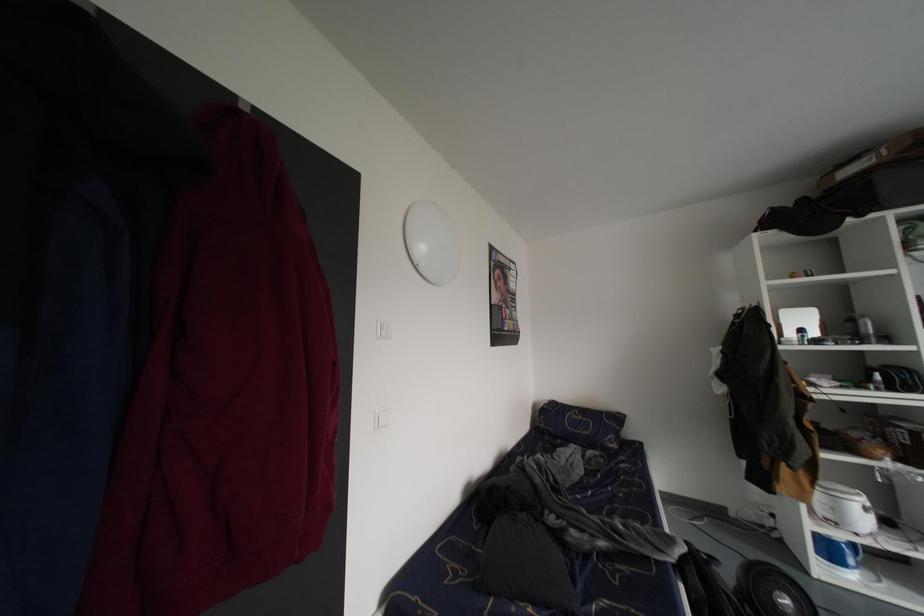
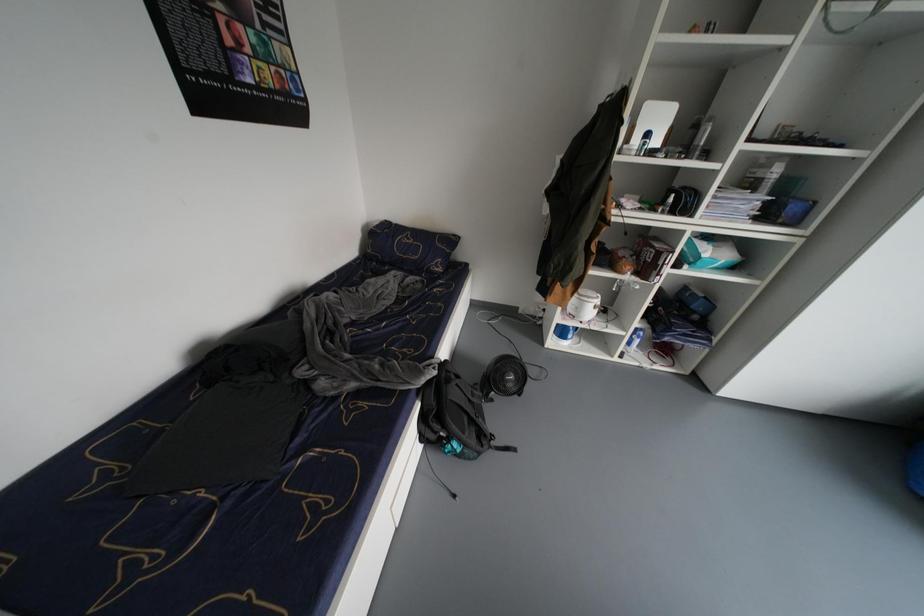
First-person continuous shooting, in which direction is the camera rotating?

The rotation direction of the camera is right-down.